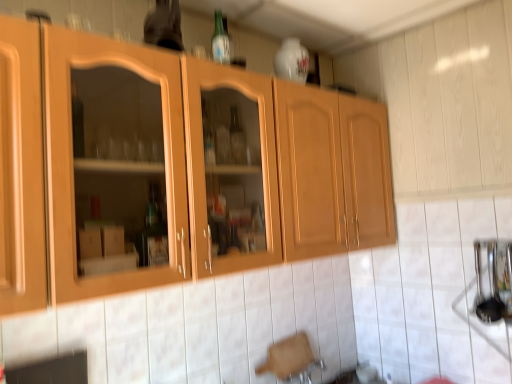
I want to click on wooden cabinet at center, so click(180, 166).

In order to face wooden cabinet at center, should I rotate leftwards or rightwards?

To face it directly, rotate left by 1.659 degrees.

Describe the element at coordinates (180, 166) in the screenshot. I see `wooden cabinet at center` at that location.

What is the approximate height of wooden cabinet at center?

28.47 inches.

This screenshot has width=512, height=384. What do you see at coordinates (164, 26) in the screenshot?
I see `matte glass bottle at upper center` at bounding box center [164, 26].

This screenshot has height=384, width=512. In order to click on matte glass bottle at upper center in this screenshot , I will do `click(164, 26)`.

Find the location of `wooden cabinet at center`. wooden cabinet at center is located at coordinates (180, 166).

Is matte glass bottle at upper center to the right of wooden cabinet at center from the viewer's perspective?

Incorrect, matte glass bottle at upper center is not on the right side of wooden cabinet at center.

Consider the image. Which object is closer to the camera, matte glass bottle at upper center or wooden cabinet at center?

wooden cabinet at center is in front.

Is point (164, 12) closer or farther from the camera than point (386, 158)?

Point (164, 12) appears to be closer to the viewer than point (386, 158).

In the scene shown: From the image's perspective, which one is positioned lower, matte glass bottle at upper center or wooden cabinet at center?

wooden cabinet at center, from the image's perspective.

Consider the image. From a real-world perspective, which is physically above, matte glass bottle at upper center or wooden cabinet at center?

From a 3D spatial view, matte glass bottle at upper center is above.

Consider the image. In terms of width, does matte glass bottle at upper center look wider or thinner when compared to wooden cabinet at center?

Considering their sizes, matte glass bottle at upper center looks slimmer than wooden cabinet at center.

Is matte glass bottle at upper center taller or shorter than wooden cabinet at center?

Clearly, matte glass bottle at upper center is shorter compared to wooden cabinet at center.

Is matte glass bottle at upper center bigger or smaller than wooden cabinet at center?

matte glass bottle at upper center is smaller than wooden cabinet at center.

Is matte glass bottle at upper center located outside wooden cabinet at center?

Yes, matte glass bottle at upper center is located beyond the bounds of wooden cabinet at center.

Is matte glass bottle at upper center next to wooden cabinet at center?

matte glass bottle at upper center is not next to wooden cabinet at center, and they're not touching.

Is matte glass bottle at upper center oriented away from wooden cabinet at center?

No, matte glass bottle at upper center's orientation is not away from wooden cabinet at center.

How different are the orientations of matte glass bottle at upper center and wooden cabinet at center in degrees?

matte glass bottle at upper center and wooden cabinet at center are facing 6.63 degrees away from each other.

The height and width of the screenshot is (384, 512). I want to click on bottle to the left of wooden cabinet at center, so click(x=164, y=26).

In the image, is wooden cabinet at center on the left side or the right side of matte glass bottle at upper center?

wooden cabinet at center is positioned on matte glass bottle at upper center's right side.

Looking at this image, in the image, is wooden cabinet at center positioned in front of or behind matte glass bottle at upper center?

Clearly, wooden cabinet at center is in front of matte glass bottle at upper center.

Does point (267, 170) appear closer or farther from the camera than point (150, 28)?

Clearly, point (267, 170) is more distant from the camera than point (150, 28).

From the image's perspective, is wooden cabinet at center under matte glass bottle at upper center?

Correct, wooden cabinet at center appears lower than matte glass bottle at upper center in the image.

From a real-world perspective, which is physically above, wooden cabinet at center or matte glass bottle at upper center?

In real-world perspective, matte glass bottle at upper center is above.

Considering the relative sizes of wooden cabinet at center and matte glass bottle at upper center in the image provided, is wooden cabinet at center wider than matte glass bottle at upper center?

Yes.

Is wooden cabinet at center taller than matte glass bottle at upper center?

Yes, wooden cabinet at center is taller than matte glass bottle at upper center.

Based on the photo, between wooden cabinet at center and matte glass bottle at upper center, which one has larger size?

wooden cabinet at center is bigger.

Does wooden cabinet at center contain matte glass bottle at upper center?

No.

Based on the photo, are wooden cabinet at center and matte glass bottle at upper center beside each other?

No, wooden cabinet at center is not with matte glass bottle at upper center.

Is wooden cabinet at center aimed at matte glass bottle at upper center?

No.

How many degrees apart are the facing directions of wooden cabinet at center and matte glass bottle at upper center?

The angle between the facing direction of wooden cabinet at center and the facing direction of matte glass bottle at upper center is 6.63 degrees.

Where is `cabinetry below the matte glass bottle at upper center (from the image's perspective)`? The height and width of the screenshot is (384, 512). cabinetry below the matte glass bottle at upper center (from the image's perspective) is located at coordinates click(180, 166).

You are a GUI agent. You are given a task and a screenshot of the screen. Output one action in this format:
    pyautogui.click(x=<x>, y=<y>)
    Task: Click on the bottle that appears behind the wooden cabinet at center
    
    Given the screenshot: What is the action you would take?
    pyautogui.click(x=164, y=26)

Image resolution: width=512 pixels, height=384 pixels. Identify the location of cabinetry that appears in front of the matte glass bottle at upper center. (180, 166).